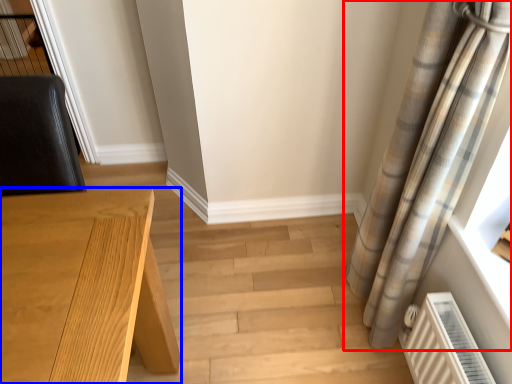
Question: Among these objects, which one is nearest to the camera, curtain (highlighted by a red box) or table (highlighted by a blue box)?

Choices:
 (A) curtain
 (B) table

Answer: (B)